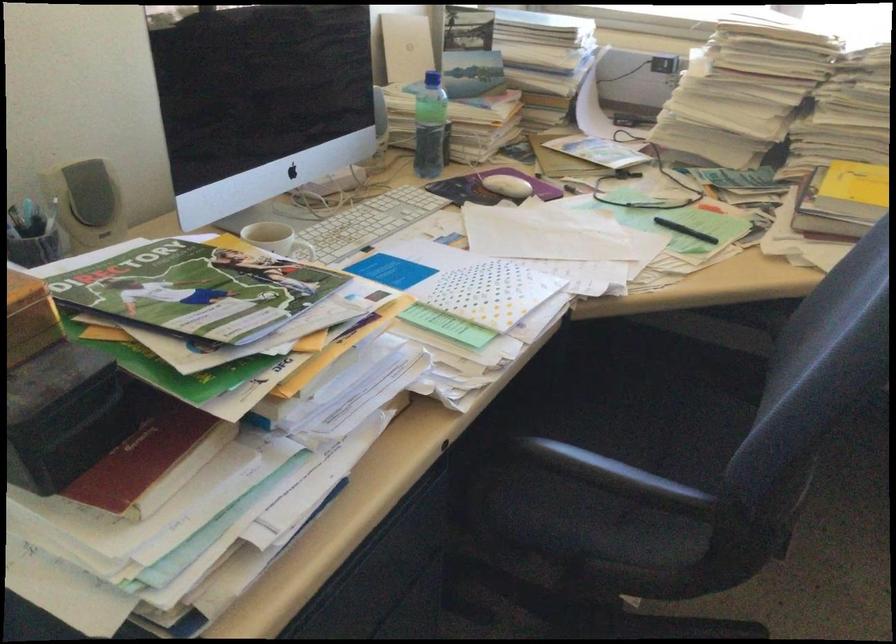
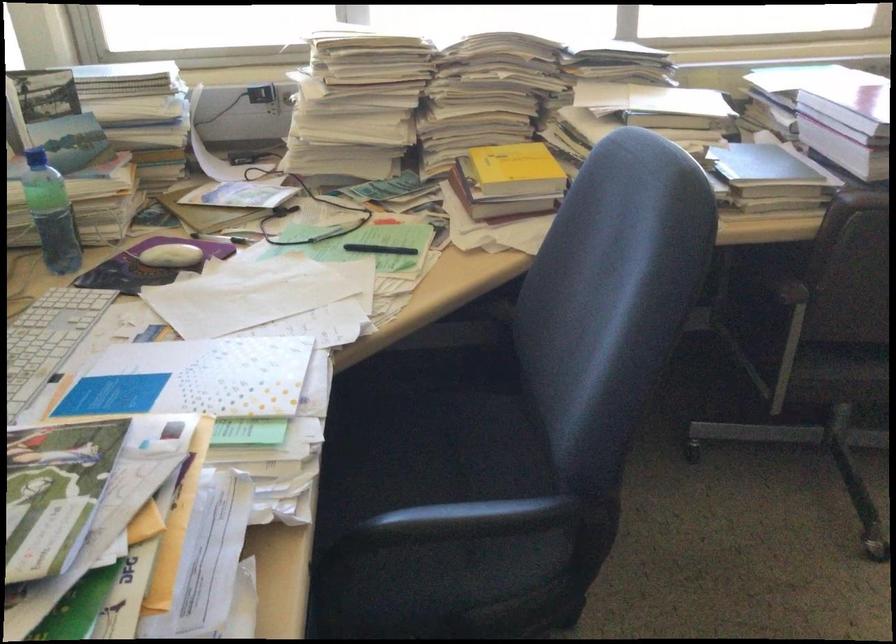
Question: How did the camera likely rotate?

Choices:
 (A) Left
 (B) Right
 (C) Up
 (D) Down

Answer: (B)